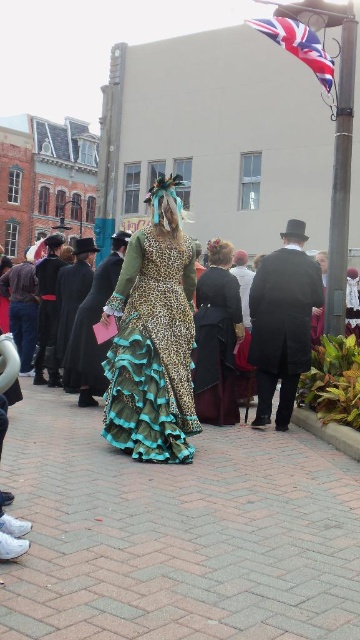
You are standing in the cobblestone street scene and want to walk from point A to point B. Point A is at coordinate point(251, 364) and point B is at coordinate point(42, 369). Which point is closer to you?

Point(251, 364) is closer to the viewer than point(42, 369).

You are a photographer at the event and need to capture both the smooth black coat at center and the matte black coat at left in a single shot. Based on their positions, which coat is closer to the camera?

The smooth black coat at center is closer to the camera because it is positioned below the matte black coat at left, indicating it is in front.

You are a photographer trying to capture both the smooth black coat at center and the metallic pole at upper right in a single frame. Given their positions and sizes, which object will appear larger in the photo?

The metallic pole at upper right will appear larger in the photo because the smooth black coat at center is shorter than the metallic pole at upper right.